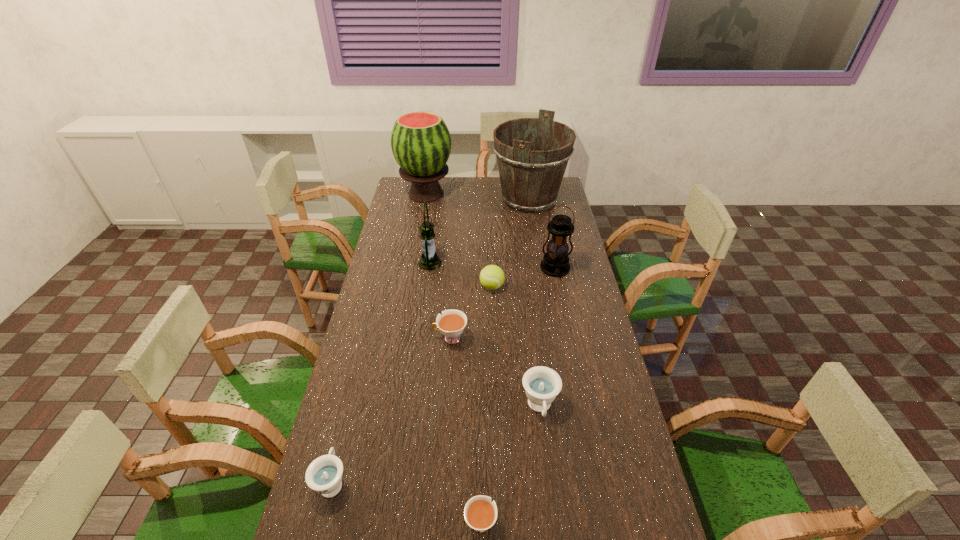
You are a GUI agent. You are given a task and a screenshot of the screen. Output one action in this format:
    pyautogui.click(x=<x>, y=<y>)
    Task: Click on the teacup that is the closest one to the tennis ball
    Image resolution: width=960 pixels, height=540 pixels.
    Given the screenshot: What is the action you would take?
    pyautogui.click(x=451, y=323)

Locate an element on the screen. teacup that is the second closest to the green tennis ball is located at coordinates (542, 384).

Identify the location of blue teacup that can be found as the second closest to the left lantern. The height and width of the screenshot is (540, 960). (324, 475).

You are a GUI agent. You are given a task and a screenshot of the screen. Output one action in this format:
    pyautogui.click(x=<x>, y=<y>)
    Task: Click on the blue teacup object that ranks as the closest to the farthest teacup
    The height and width of the screenshot is (540, 960).
    Given the screenshot: What is the action you would take?
    pyautogui.click(x=542, y=384)